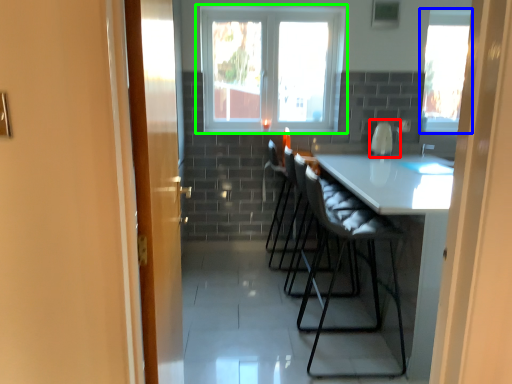
Question: Which object is positioned farthest from appliance (highlighted by a red box)? Select from window (highlighted by a blue box) and window (highlighted by a green box).

Choices:
 (A) window
 (B) window

Answer: (B)